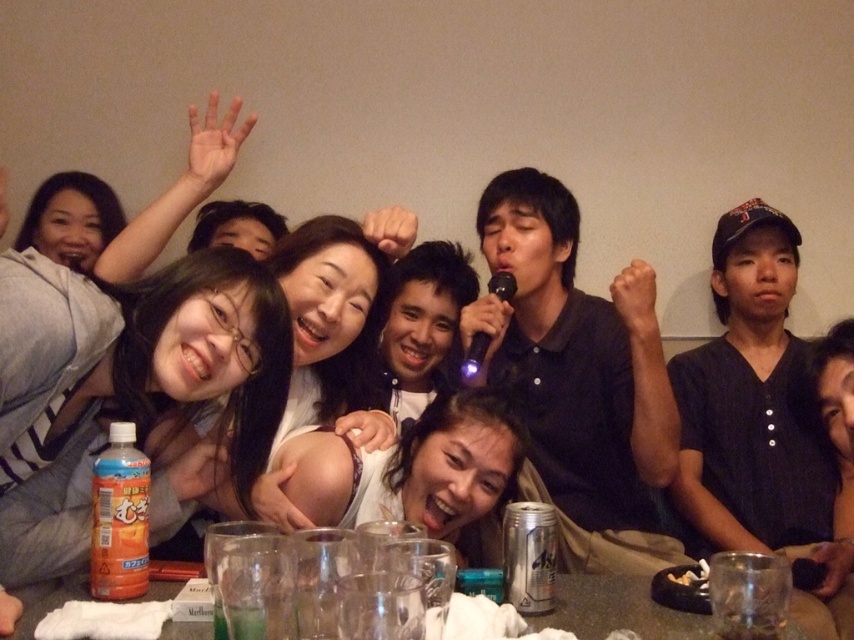
You are a photographer trying to capture a candid shot of the smooth white shirt at center without the black matte microphone at center blocking the view. Is this possible given their positions?

The black matte microphone at center is further to the viewer than the smooth white shirt at center, so it would block the view of the smooth white shirt at center. Therefore, capturing the shirt without the microphone blocking would not be possible from your current angle.

Consider the image. You are standing at the entrance of the room and want to hand a gift to the person closest to the black matte microphone at center. Which direction should you walk towards?

The black matte microphone at center is located at coordinates point (574, 356), so you should walk towards the center of the room to reach the person closest to it.

You are standing in front of the table and want to place a small decorative item on the table. You have two options for placement based on coordinates given in the image. The first option is at point (305,481) and the second is at point (677,612). Which point is closer to you, making it easier to reach without moving your position?

Point (305,481) is closer to you than point (677,612), so it is easier to reach without moving your position.